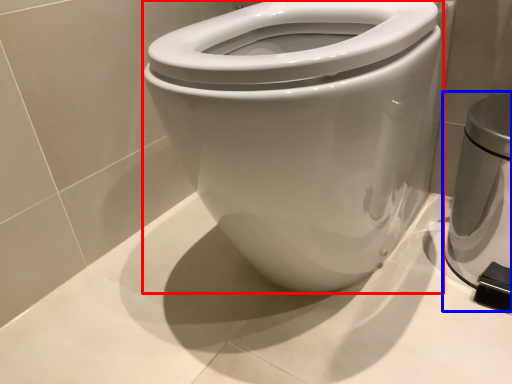
Question: Among these objects, which one is nearest to the camera, bidet (highlighted by a red box) or appliance (highlighted by a blue box)?

Choices:
 (A) bidet
 (B) appliance

Answer: (A)